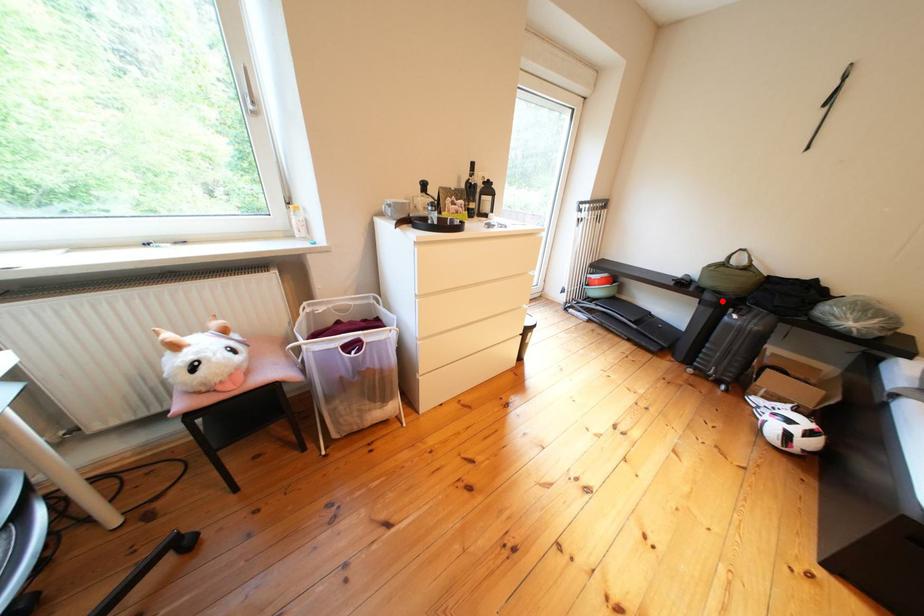
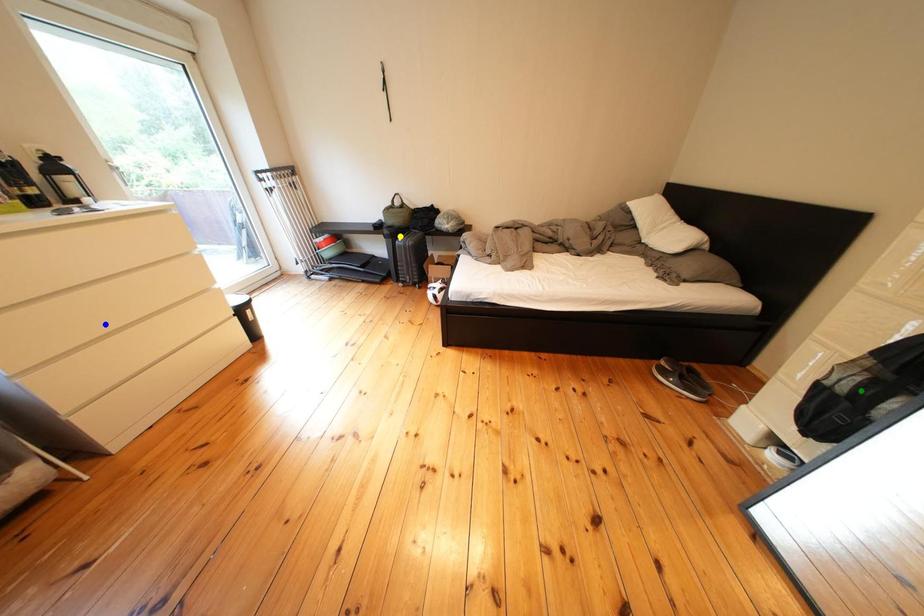
Question: I am providing you with two images of the same scene from different viewpoints. A red point is marked on the first image. You are given multiple points on the second image. Which mark in image 2 goes with the point in image 1?

Choices:
 (A) green point
 (B) yellow point
 (C) blue point

Answer: (B)